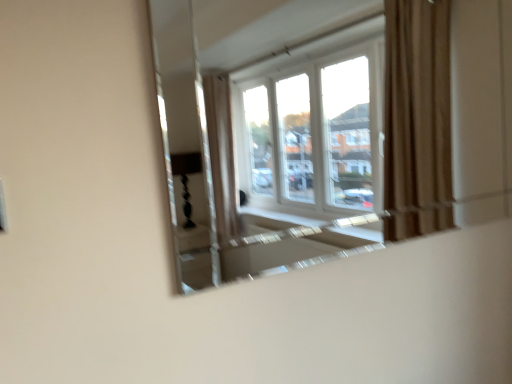
I want to click on clear glass mirror at center, so click(x=298, y=128).

The height and width of the screenshot is (384, 512). What do you see at coordinates (298, 128) in the screenshot?
I see `clear glass mirror at center` at bounding box center [298, 128].

In order to face clear glass mirror at center, should I rotate leftwards or rightwards?

Turn right approximately 16.834 degrees to face it.

Where is `clear glass mirror at center`? Image resolution: width=512 pixels, height=384 pixels. clear glass mirror at center is located at coordinates (298, 128).